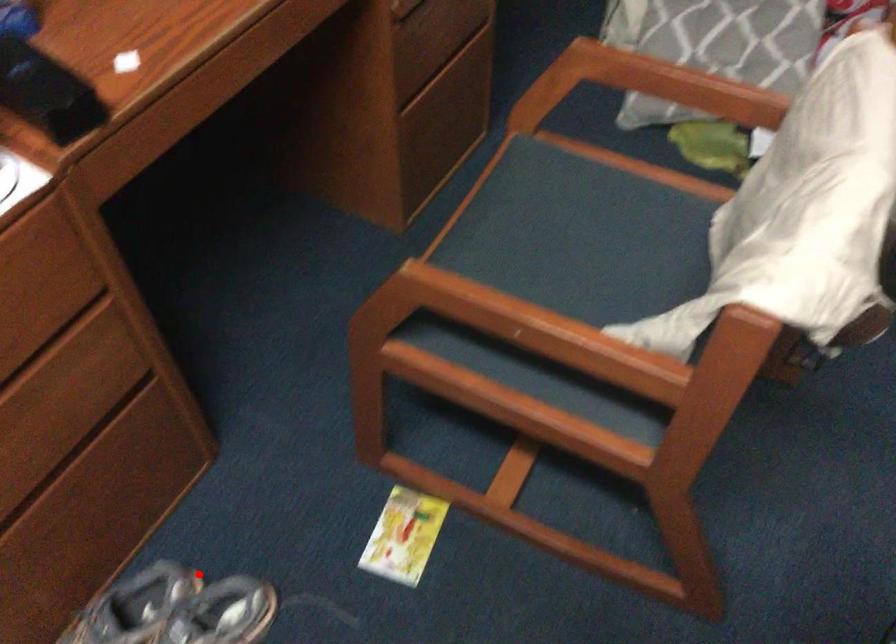
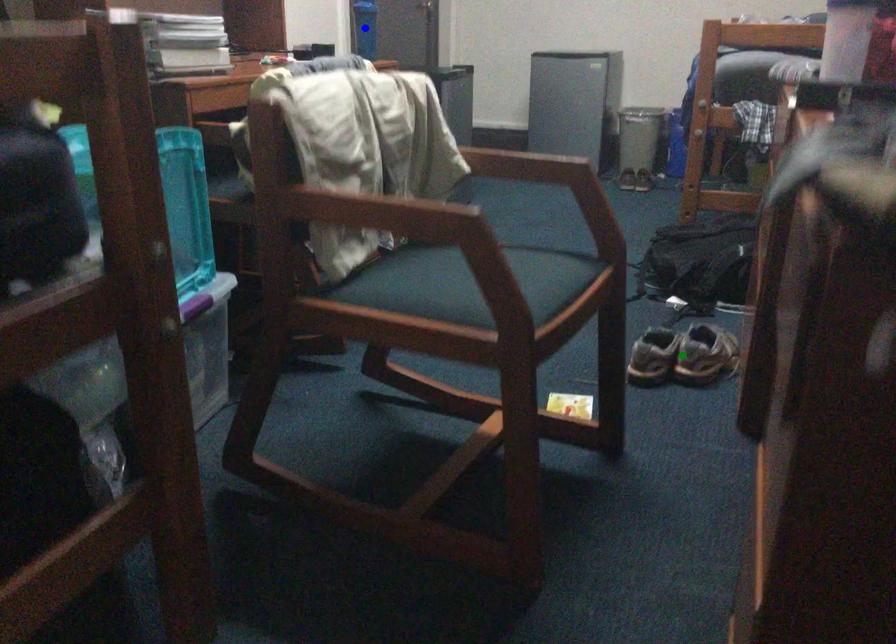
Question: I am providing you with two images of the same scene from different viewpoints. A red point is marked on the first image. You are given multiple points on the second image. Which spot in image 2 lines up with the point in image 1?

Choices:
 (A) yellow point
 (B) blue point
 (C) green point

Answer: (A)